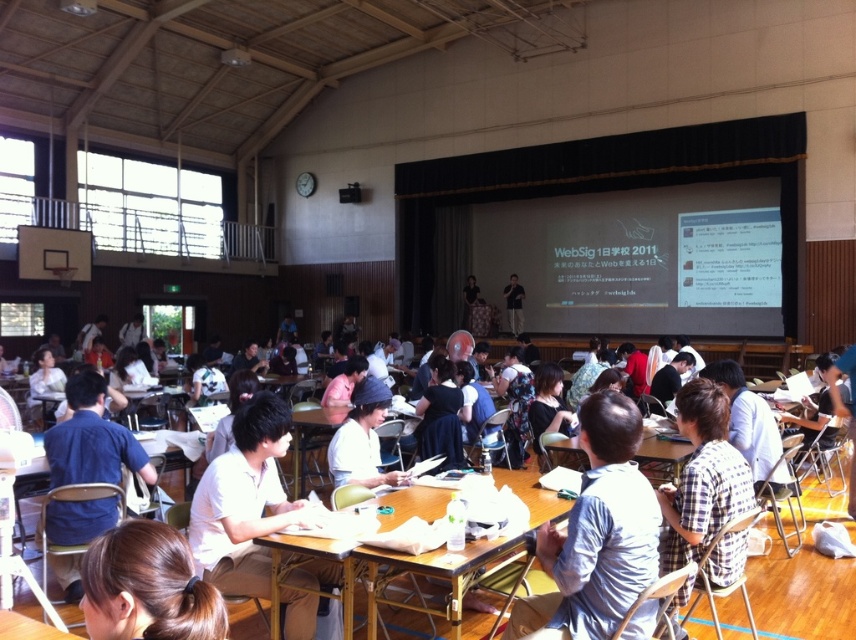
You are standing at the entrance of the hall and want to find the person with brown hair at lower left. According to the coordinates provided, where should you look relative to the entrance?

The brown hair at lower left is located at point 0.917 on the x axis and 0.173 on the y axis, so you should look towards the lower left direction from the entrance to find them.

You are a photographer standing at the back of the hall. You want to take a photo of the brown hair at lower left and ensure that both subjects are in focus. What is the minimum distance you should set your camera lens to focus on?

The two individuals are 4.13 feet apart. To ensure both are in focus, set the focus distance to the midpoint between them, which is approximately 2.065 feet from each subject.